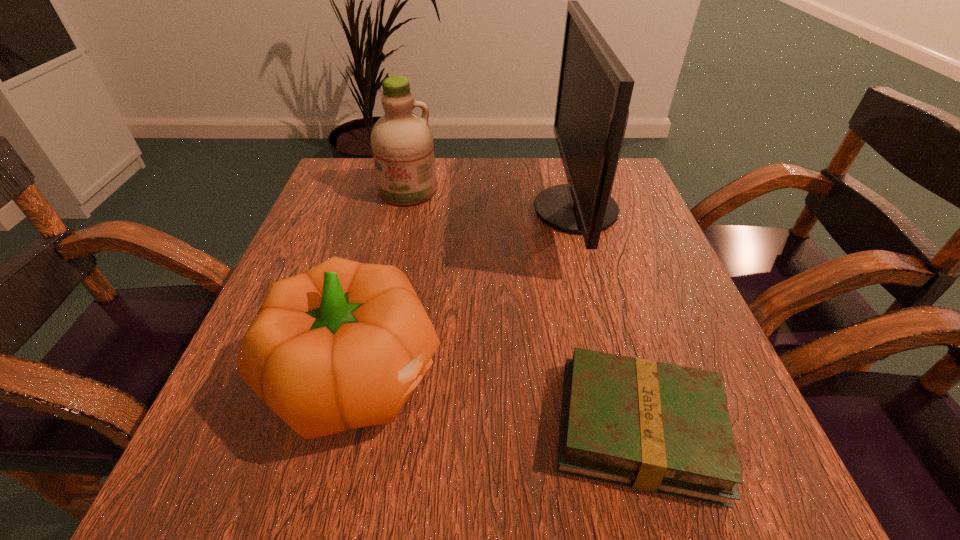
Locate an element on the screen. This screenshot has height=540, width=960. monitor present at the far edge is located at coordinates click(594, 92).

You are a GUI agent. You are given a task and a screenshot of the screen. Output one action in this format:
    pyautogui.click(x=<x>, y=<y>)
    Task: Click on the cleansing agent located at the far edge
    The image size is (960, 540).
    Given the screenshot: What is the action you would take?
    pyautogui.click(x=402, y=145)

What are the coordinates of `pumpkin at the near edge` in the screenshot? It's located at (343, 345).

Where is `book that is at the near edge`? The width and height of the screenshot is (960, 540). book that is at the near edge is located at coordinates (657, 427).

Identify the location of cleansing agent positioned at the left edge. This screenshot has width=960, height=540. (402, 145).

Image resolution: width=960 pixels, height=540 pixels. I want to click on pumpkin positioned at the left edge, so tap(343, 345).

What are the coordinates of `monitor at the right edge` in the screenshot? It's located at coord(594,92).

You are a GUI agent. You are given a task and a screenshot of the screen. Output one action in this format:
    pyautogui.click(x=<x>, y=<y>)
    Task: Click on the book located in the right edge section of the desktop
    This screenshot has height=540, width=960.
    Given the screenshot: What is the action you would take?
    pyautogui.click(x=657, y=427)

Image resolution: width=960 pixels, height=540 pixels. In order to click on object located at the far left corner in this screenshot , I will do `click(402, 145)`.

The height and width of the screenshot is (540, 960). Find the location of `object at the near left corner`. object at the near left corner is located at coordinates (343, 345).